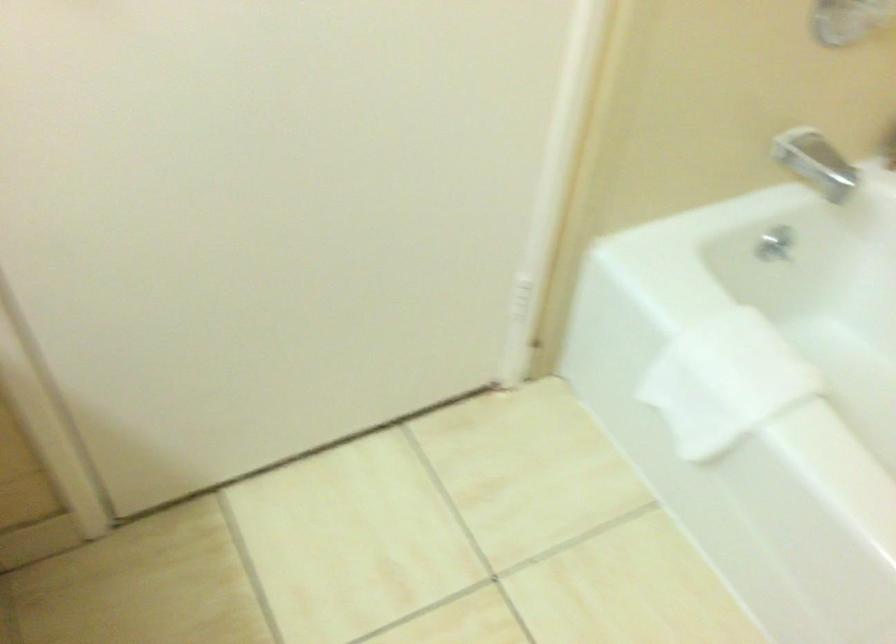
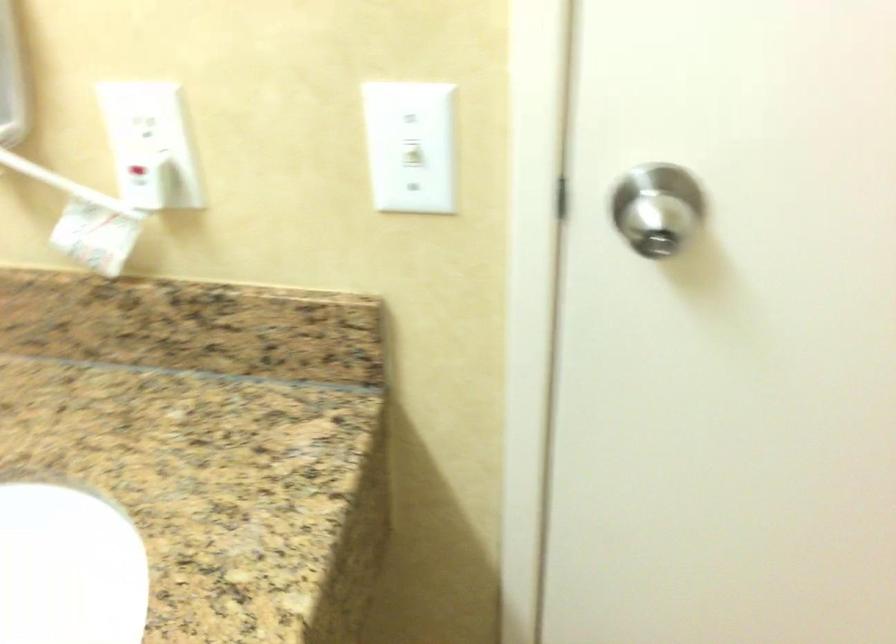
Question: Based on the continuous images, in which direction is the camera rotating? Reply with the corresponding letter.

Choices:
 (A) Left
 (B) Right
 (C) Up
 (D) Down

Answer: (A)